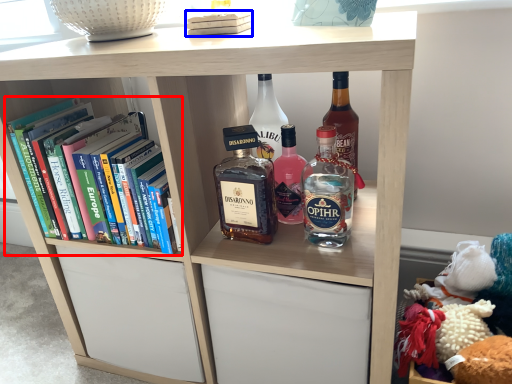
Question: Which object appears closest to the camera in this image, book (highlighted by a red box) or book (highlighted by a blue box)?

Choices:
 (A) book
 (B) book

Answer: (B)